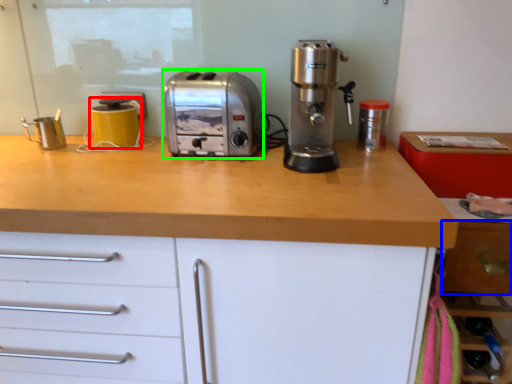
Question: Considering the real-world distances, which object is closest to kitchen appliance (highlighted by a red box)? drawer (highlighted by a blue box) or toaster (highlighted by a green box).

Choices:
 (A) drawer
 (B) toaster

Answer: (B)